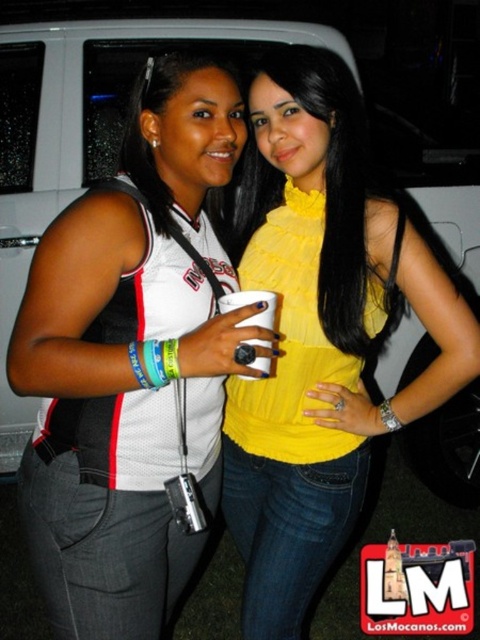
Who is more forward, (196, 170) or (321, 108)?

Point (196, 170)

Between white jersey at center and yellow satin blouse at center, which one appears on the left side from the viewer's perspective?

white jersey at center

Between point (60, 532) and point (297, 560), which one is positioned in front?

Point (60, 532)

Where is `white jersey at center`? white jersey at center is located at coordinates (132, 362).

Is yellow satin blouse at center below white paper cup at center?

Yes, yellow satin blouse at center is below white paper cup at center.

Between point (312, 417) and point (252, 321), which one is positioned behind?

The point (312, 417) is behind.

What are the coordinates of `yellow satin blouse at center` in the screenshot? It's located at (321, 332).

Who is positioned more to the left, white jersey at center or white paper cup at center?

Positioned to the left is white jersey at center.

Is point (41, 289) in front of point (248, 291)?

Yes, it is in front of point (248, 291).

Does point (96, 285) come in front of point (249, 294)?

Yes, point (96, 285) is closer to viewer.

Locate an element on the screen. This screenshot has width=480, height=640. white jersey at center is located at coordinates (132, 362).